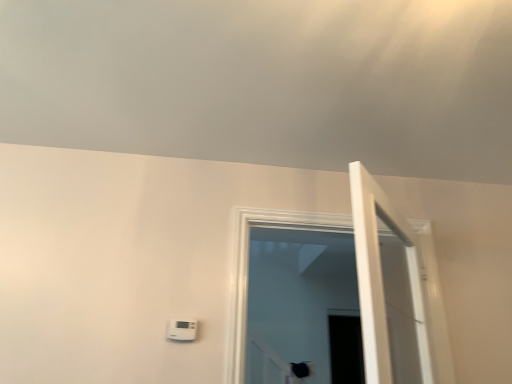
Find the location of a particular element. The height and width of the screenshot is (384, 512). white wooden door at right is located at coordinates (385, 281).

This screenshot has width=512, height=384. What are the coordinates of `white wooden door at right` in the screenshot? It's located at (385, 281).

Who is taller, transparent glass door at center or white plastic thermostat at lower center?

transparent glass door at center.

Does point (232, 238) appear closer or farther from the camera than point (193, 330)?

Point (232, 238) is positioned farther from the camera compared to point (193, 330).

Consider the image. Is transparent glass door at center smaller than white plastic thermostat at lower center?

Actually, transparent glass door at center might be larger than white plastic thermostat at lower center.

From the image's perspective, is transparent glass door at center located above or below white plastic thermostat at lower center?

transparent glass door at center is situated higher than white plastic thermostat at lower center in the image.

Would you consider white wooden door at right to be distant from white plastic thermostat at lower center?

white wooden door at right is near white plastic thermostat at lower center, not far away.

Which of these two, white wooden door at right or white plastic thermostat at lower center, stands shorter?

white plastic thermostat at lower center.

Is white wooden door at right in front of or behind white plastic thermostat at lower center in the image?

white wooden door at right is positioned closer to the viewer than white plastic thermostat at lower center.

How different are the orientations of white wooden door at right and white plastic thermostat at lower center in degrees?

They differ by 50.9 degrees in their facing directions.

Is white plastic thermostat at lower center looking in the opposite direction of white wooden door at right?

That's not correct — white plastic thermostat at lower center is not looking away from white wooden door at right.

Image resolution: width=512 pixels, height=384 pixels. I want to click on door above the white plastic thermostat at lower center (from the image's perspective), so click(x=385, y=281).

Is white plastic thermostat at lower center positioned beyond the bounds of white wooden door at right?

Absolutely, white plastic thermostat at lower center is external to white wooden door at right.

From a real-world perspective, between white plastic thermostat at lower center and white wooden door at right, who is vertically higher?

In real-world perspective, white wooden door at right is above.

Does point (189, 320) come farther from viewer compared to point (429, 374)?

That is True.

From the image's perspective, is white plastic thermostat at lower center under transparent glass door at center?

Yes.

The height and width of the screenshot is (384, 512). I want to click on light switch lying on the left of transparent glass door at center, so click(x=182, y=330).

Which object is positioned more to the right, white plastic thermostat at lower center or transparent glass door at center?

transparent glass door at center.

Does point (244, 251) come farther from viewer compared to point (378, 291)?

Yes.

In the image, there is a transparent glass door at center. Where is `door below it (from a real-world perspective)`? door below it (from a real-world perspective) is located at coordinates (385, 281).

Which of these two, transparent glass door at center or white wooden door at right, is wider?

transparent glass door at center.

From the image's perspective, is transparent glass door at center located beneath white wooden door at right?

Yes, from the image's perspective, transparent glass door at center is beneath white wooden door at right.

Which of these two, white wooden door at right or transparent glass door at center, is thinner?

With smaller width is white wooden door at right.

You are a GUI agent. You are given a task and a screenshot of the screen. Output one action in this format:
    pyautogui.click(x=<x>, y=<y>)
    Task: Click on the door in front of the transparent glass door at center
    This screenshot has width=512, height=384.
    Given the screenshot: What is the action you would take?
    point(385,281)

Could you tell me if white wooden door at right is turned towards transparent glass door at center?

No, white wooden door at right is not aimed at transparent glass door at center.

Is point (411, 257) farther from camera compared to point (234, 268)?

Yes.

Where is `light switch located below the transparent glass door at center (from the image's perspective)`? light switch located below the transparent glass door at center (from the image's perspective) is located at coordinates (182, 330).

Find the location of a particular element. The image size is (512, 384). light switch behind the white wooden door at right is located at coordinates (182, 330).

Which object lies further to the anchor point white plastic thermostat at lower center, transparent glass door at center or white wooden door at right?

white wooden door at right is further to white plastic thermostat at lower center.

When comparing their distances from transparent glass door at center, does white plastic thermostat at lower center or white wooden door at right seem further?

The object further to transparent glass door at center is white wooden door at right.

When comparing their distances from white wooden door at right, does transparent glass door at center or white plastic thermostat at lower center seem further?

white plastic thermostat at lower center is further to white wooden door at right.

Estimate the real-world distances between objects in this image. Which object is closer to white wooden door at right, white plastic thermostat at lower center or transparent glass door at center?

transparent glass door at center lies closer to white wooden door at right than the other object.

From the image, which object appears to be farther from transparent glass door at center, white wooden door at right or white plastic thermostat at lower center?

white wooden door at right is positioned further to the anchor transparent glass door at center.

When comparing their distances from white plastic thermostat at lower center, does white wooden door at right or transparent glass door at center seem closer?

transparent glass door at center is positioned closer to the anchor white plastic thermostat at lower center.

In order to click on window between white plastic thermostat at lower center and white wooden door at right from left to right in this screenshot , I will do pos(247,269).